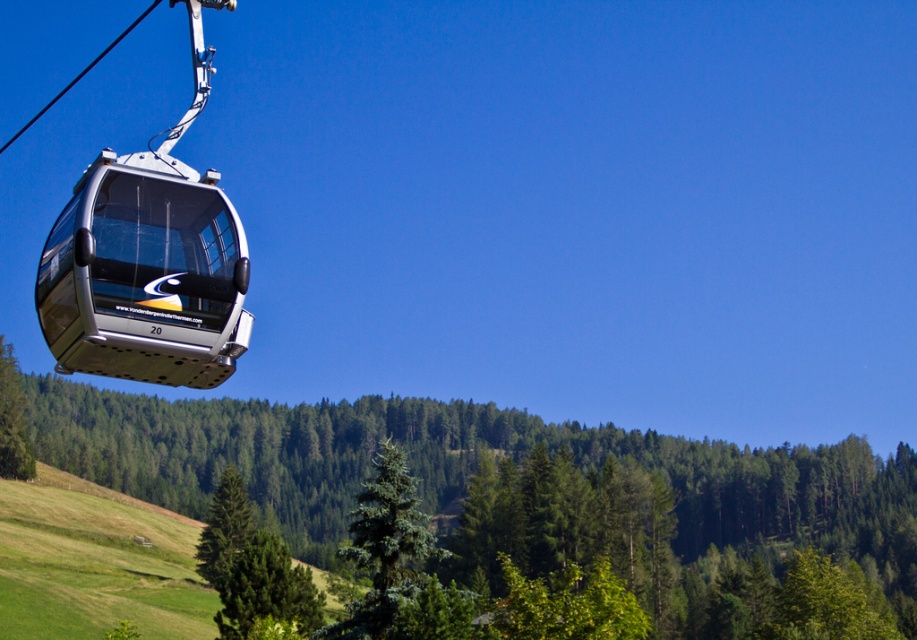
Question: Considering the real-world distances, which object is closest to the metallic cable car at left?

Choices:
 (A) green fir tree at center
 (B) green matte tree at center

Answer: (A)

Question: Which of these objects is positioned closest to the green matte tree at center?

Choices:
 (A) metallic cable car at left
 (B) green fir tree at center

Answer: (B)

Question: Does metallic cable car at left lie in front of green fir tree at center?

Choices:
 (A) yes
 (B) no

Answer: (A)

Question: Is green matte tree at center above green fir tree at center?

Choices:
 (A) yes
 (B) no

Answer: (B)

Question: Can you confirm if green matte tree at center is positioned above metallic cable car at left?

Choices:
 (A) no
 (B) yes

Answer: (A)

Question: Estimate the real-world distances between objects in this image. Which object is closer to the green fir tree at center?

Choices:
 (A) metallic cable car at left
 (B) green matte tree at center

Answer: (A)